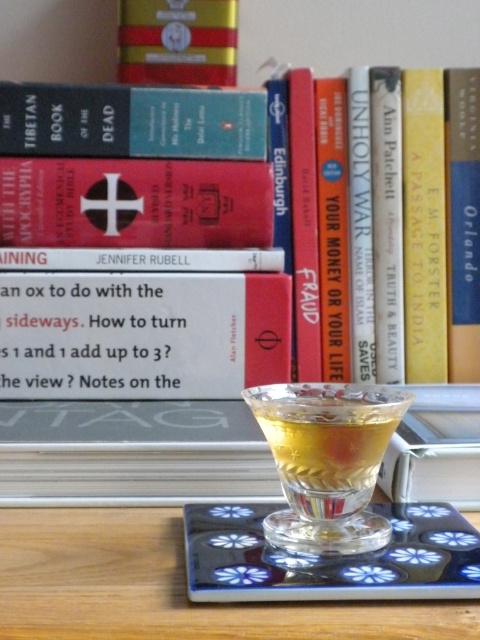
Question: Among these objects, which one is farthest from the camera?

Choices:
 (A) white paper book at center
 (B) dark blue hardcover book at upper left

Answer: (B)

Question: Considering the real-world distances, which object is closest to the hardcover book at upper center?

Choices:
 (A) white paper book at center
 (B) matte red book at center

Answer: (B)

Question: Which is farther from the transparent glass cocktail at center?

Choices:
 (A) matte red book at center
 (B) hardcover book at upper center

Answer: (B)

Question: Is dark blue hardcover book at upper left thinner than hardcover book at upper center?

Choices:
 (A) yes
 (B) no

Answer: (B)

Question: Where is white paper book at center located in relation to wooden table at center in the image?

Choices:
 (A) left
 (B) right

Answer: (A)

Question: Is wooden table at center bigger than dark blue hardcover book at upper left?

Choices:
 (A) yes
 (B) no

Answer: (A)